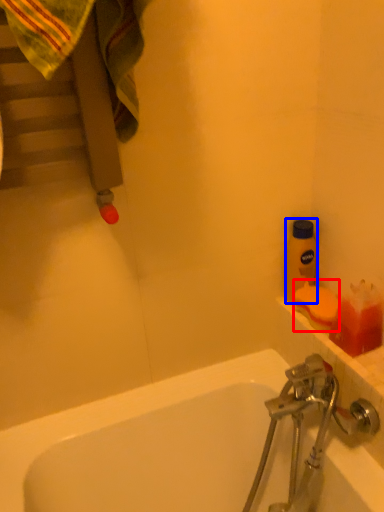
Question: Which object is closer to the camera taking this photo, soap (highlighted by a red box) or bottle (highlighted by a blue box)?

Choices:
 (A) soap
 (B) bottle

Answer: (A)